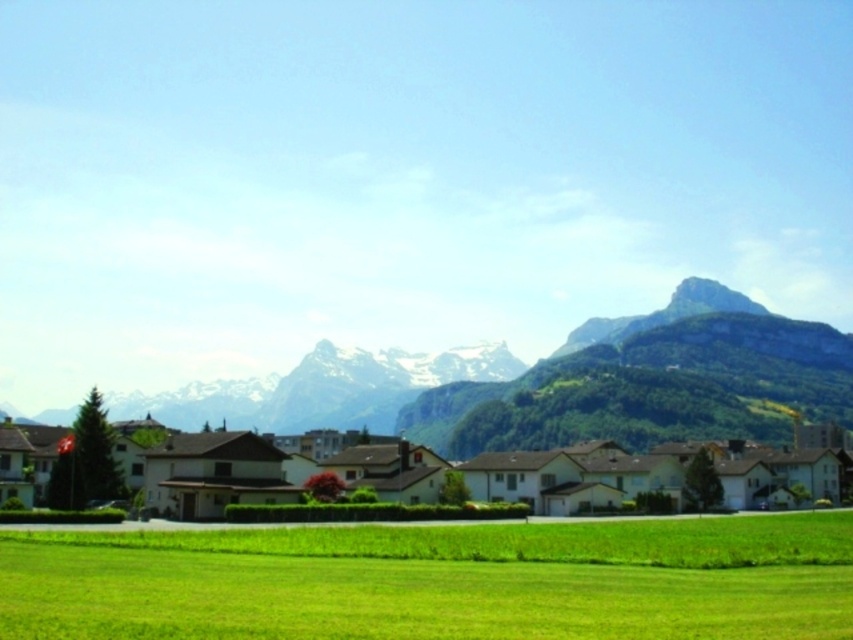
You are a surveyor measuring the elevation changes in the rural landscape. You observe the green grass at center and the green grassy hillside at lower center. Which area has a higher elevation?

The green grassy hillside at lower center has a higher elevation than the green grass at center because the green grass at center is shorter in height compared to the green grassy hillside at lower center.